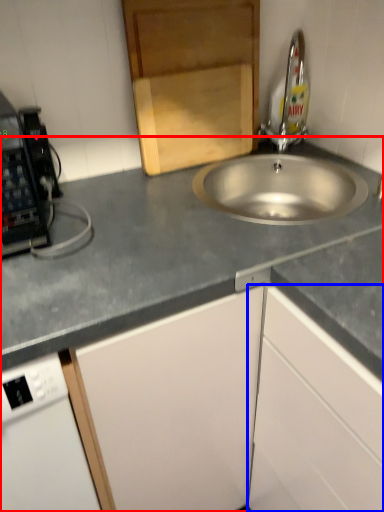
Question: Which of the following is the farthest to the observer, countertop (highlighted by a red box) or cabinetry (highlighted by a blue box)?

Choices:
 (A) countertop
 (B) cabinetry

Answer: (B)